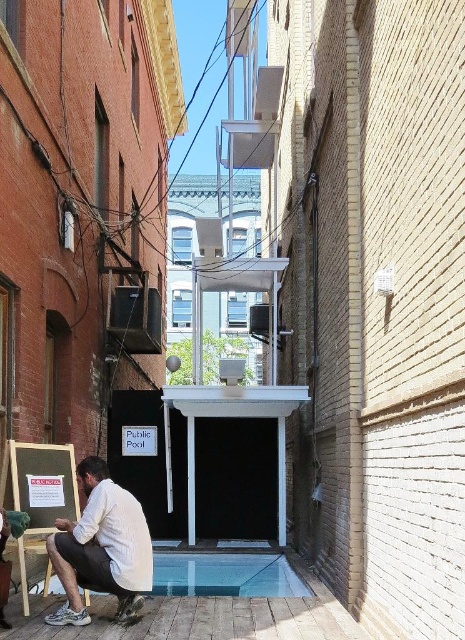
Between white cotton shirt at lower center and transparent glass pool at lower center, which one appears on the right side from the viewer's perspective?

Positioned to the right is transparent glass pool at lower center.

The height and width of the screenshot is (640, 465). What do you see at coordinates (101, 548) in the screenshot?
I see `white cotton shirt at lower center` at bounding box center [101, 548].

This screenshot has width=465, height=640. What do you see at coordinates (101, 548) in the screenshot?
I see `white cotton shirt at lower center` at bounding box center [101, 548].

This screenshot has height=640, width=465. Find the location of `white cotton shirt at lower center`. white cotton shirt at lower center is located at coordinates (101, 548).

Is white cotton shirt at lower center shorter than wooden easel at lower left?

Indeed, white cotton shirt at lower center has a lesser height compared to wooden easel at lower left.

Based on the photo, is white cotton shirt at lower center to the right of wooden easel at lower left from the viewer's perspective?

Indeed, white cotton shirt at lower center is positioned on the right side of wooden easel at lower left.

Which is in front, point (145, 531) or point (20, 572)?

Point (20, 572) is more forward.

Identify the location of white cotton shirt at lower center. (101, 548).

Does transparent glass pool at lower center appear on the left side of wooden easel at lower left?

In fact, transparent glass pool at lower center is to the right of wooden easel at lower left.

Who is positioned more to the left, transparent glass pool at lower center or wooden easel at lower left?

wooden easel at lower left is more to the left.

Is point (153, 592) more distant than point (18, 552)?

Yes, it is behind point (18, 552).

This screenshot has height=640, width=465. What are the coordinates of `transparent glass pool at lower center` in the screenshot? It's located at (225, 573).